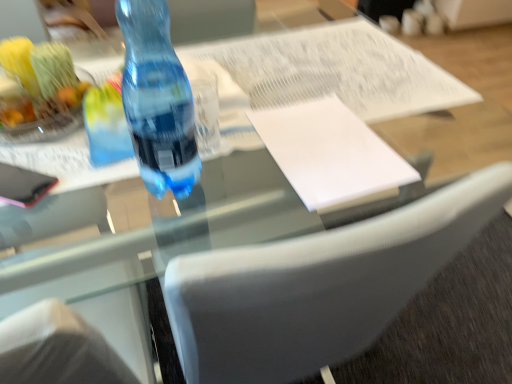
Question: Does shiny plastic fruit bowl at upper left have a lesser width compared to blue translucent bottle at center?

Choices:
 (A) yes
 (B) no

Answer: (B)

Question: Can you confirm if shiny plastic fruit bowl at upper left is wider than blue translucent bottle at center?

Choices:
 (A) no
 (B) yes

Answer: (B)

Question: From a real-world perspective, is shiny plastic fruit bowl at upper left below blue translucent bottle at center?

Choices:
 (A) no
 (B) yes

Answer: (B)

Question: Is blue translucent bottle at center a part of shiny plastic fruit bowl at upper left?

Choices:
 (A) yes
 (B) no

Answer: (B)

Question: Is shiny plastic fruit bowl at upper left facing away from blue translucent bottle at center?

Choices:
 (A) no
 (B) yes

Answer: (A)

Question: Are shiny plastic fruit bowl at upper left and blue translucent bottle at center far apart?

Choices:
 (A) yes
 (B) no

Answer: (B)

Question: Does transparent plastic bottle at center have a larger size compared to shiny plastic fruit bowl at upper left?

Choices:
 (A) yes
 (B) no

Answer: (B)

Question: Does transparent plastic bottle at center turn towards shiny plastic fruit bowl at upper left?

Choices:
 (A) no
 (B) yes

Answer: (A)

Question: Is transparent plastic bottle at center to the right of shiny plastic fruit bowl at upper left from the viewer's perspective?

Choices:
 (A) no
 (B) yes

Answer: (B)

Question: Is transparent plastic bottle at center smaller than shiny plastic fruit bowl at upper left?

Choices:
 (A) no
 (B) yes

Answer: (B)

Question: Is transparent plastic bottle at center taller than shiny plastic fruit bowl at upper left?

Choices:
 (A) yes
 (B) no

Answer: (B)

Question: Can you confirm if transparent plastic bottle at center is positioned to the left of shiny plastic fruit bowl at upper left?

Choices:
 (A) yes
 (B) no

Answer: (B)

Question: Considering the relative sizes of shiny plastic fruit bowl at upper left and white paper at center in the image provided, is shiny plastic fruit bowl at upper left thinner than white paper at center?

Choices:
 (A) no
 (B) yes

Answer: (B)